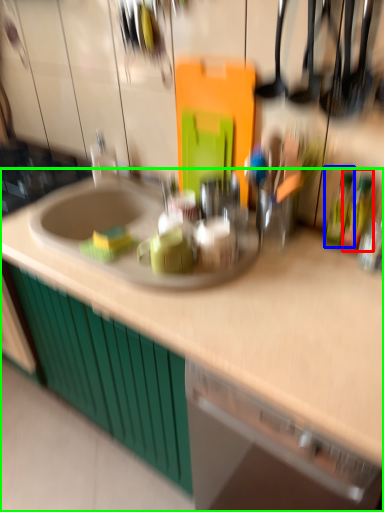
Question: Considering the real-world distances, which object is closest to bottle (highlighted by a red box)? bottle (highlighted by a blue box) or countertop (highlighted by a green box).

Choices:
 (A) bottle
 (B) countertop

Answer: (A)